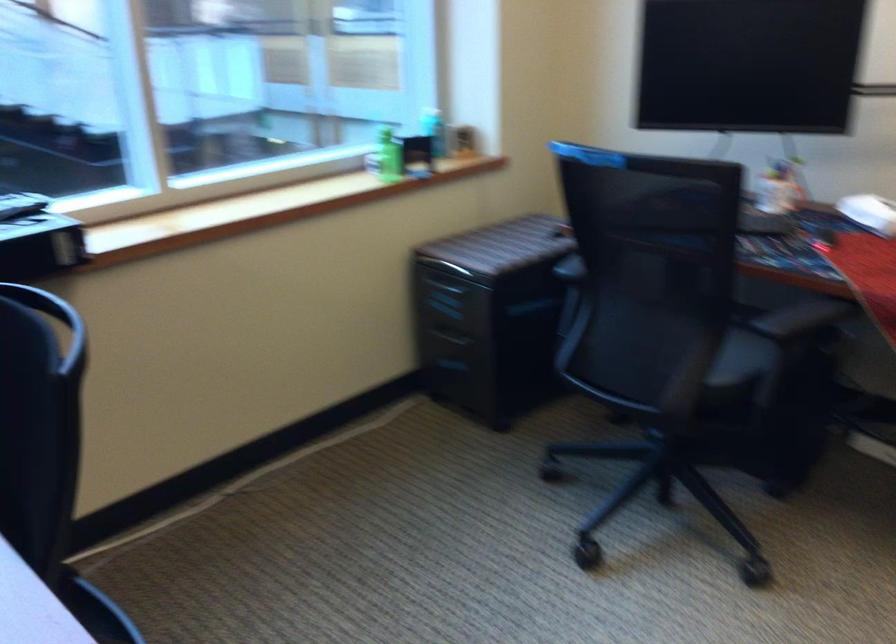
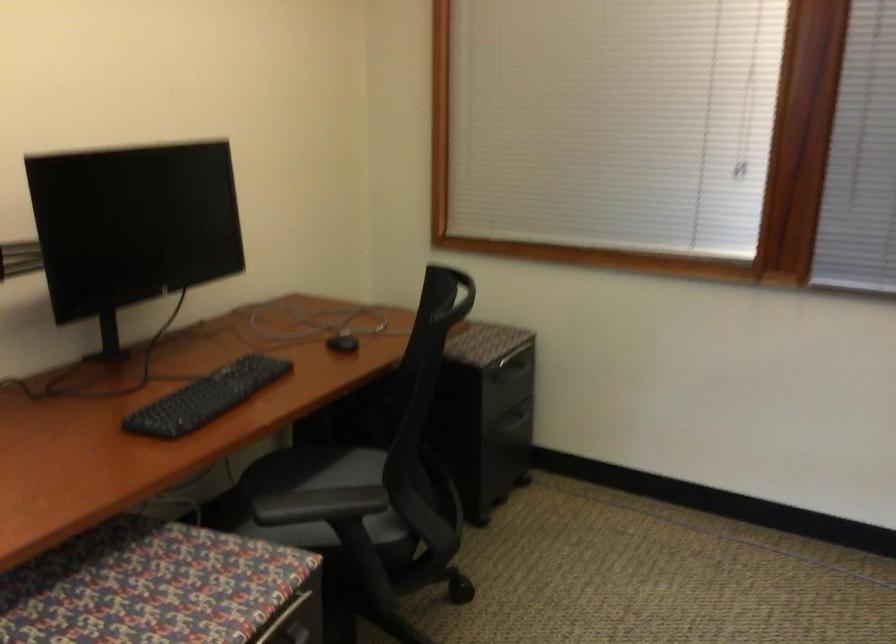
The first image is from the beginning of the video and the second image is from the end. How did the camera likely rotate when shooting the video?

The camera rotated toward right-down.